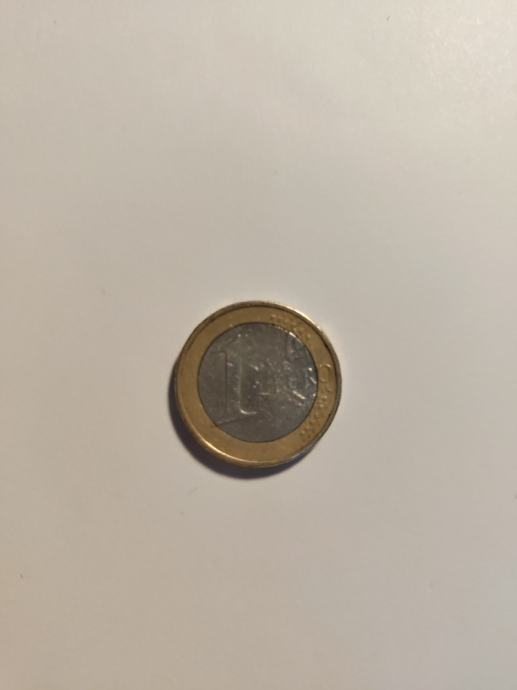
What are the coordinates of `table` in the screenshot? It's located at (79, 557).